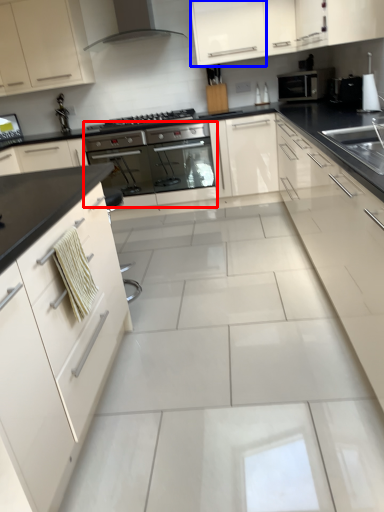
Question: Which object appears closest to the camera in this image, oven (highlighted by a red box) or cabinetry (highlighted by a blue box)?

Choices:
 (A) oven
 (B) cabinetry

Answer: (B)